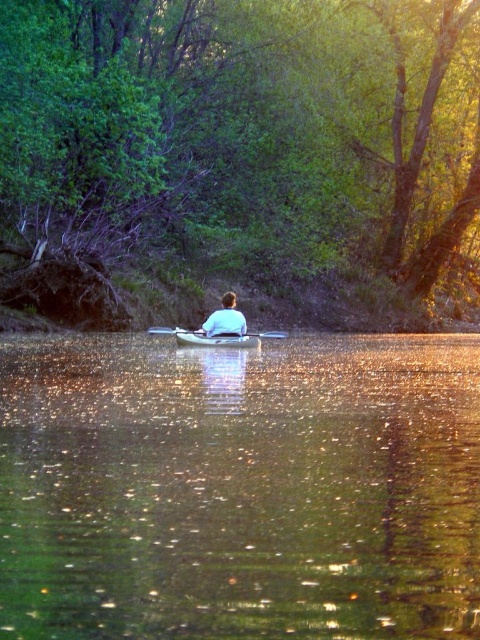
Can you confirm if green reflective water at center is positioned to the right of white cotton shirt at center?

No, green reflective water at center is not to the right of white cotton shirt at center.

Does green reflective water at center have a lesser height compared to white cotton shirt at center?

In fact, green reflective water at center may be taller than white cotton shirt at center.

Which is behind, point (372, 600) or point (219, 314)?

Positioned behind is point (219, 314).

Image resolution: width=480 pixels, height=640 pixels. Find the location of `green reflective water at center`. green reflective water at center is located at coordinates (240, 488).

Does green reflective water at center appear on the left side of smooth gray canoe at center?

Correct, you'll find green reflective water at center to the left of smooth gray canoe at center.

Is point (307, 394) positioned after point (180, 332)?

No, it is not.

Between point (64, 454) and point (220, 333), which one is positioned in front?

Positioned in front is point (64, 454).

You are a GUI agent. You are given a task and a screenshot of the screen. Output one action in this format:
    pyautogui.click(x=<x>, y=<y>)
    Task: Click on the green reflective water at center
    This screenshot has width=480, height=640.
    Given the screenshot: What is the action you would take?
    pyautogui.click(x=240, y=488)

Between green leafy tree at center and white plastic paddle at center, which one is positioned lower?

Positioned lower is white plastic paddle at center.

Is point (67, 157) in front of point (285, 336)?

No, (67, 157) is behind (285, 336).

Locate an element on the screen. green leafy tree at center is located at coordinates (236, 141).